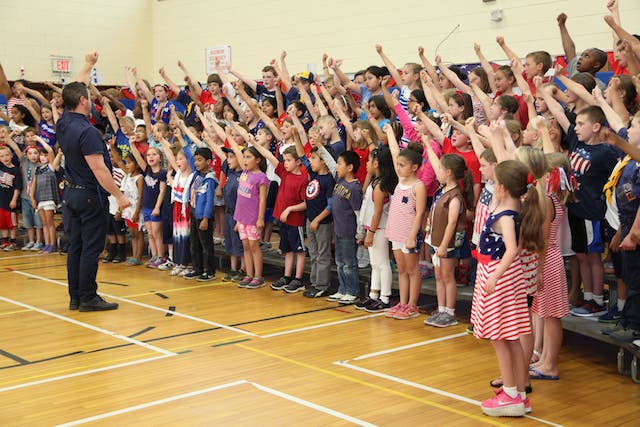
This screenshot has width=640, height=427. I want to click on exit sign, so click(x=63, y=63).